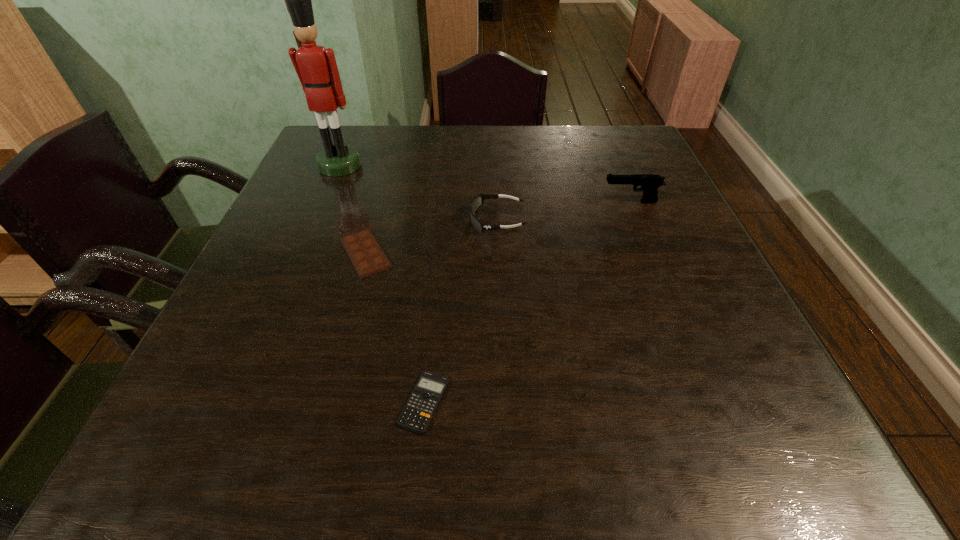
The image size is (960, 540). What are the coordinates of `object present at the near edge` in the screenshot? It's located at (418, 411).

Where is `object that is at the left edge`? object that is at the left edge is located at coordinates (316, 67).

At what (x,y) coordinates should I click in order to perform the action: click on object that is at the right edge. Please return your answer as a coordinate pair (x, y). The height and width of the screenshot is (540, 960). Looking at the image, I should click on (649, 183).

The width and height of the screenshot is (960, 540). I want to click on object present at the far left corner, so click(x=316, y=67).

Locate an element on the screen. The width and height of the screenshot is (960, 540). free region at the far edge is located at coordinates (416, 136).

I want to click on vacant area at the near edge of the desktop, so click(x=610, y=464).

Image resolution: width=960 pixels, height=540 pixels. I want to click on vacant area at the left edge of the desktop, so click(309, 265).

Find the location of a particular element. The image size is (960, 540). vacant space at the right edge is located at coordinates (660, 199).

Identify the location of blank space at the near left corner. (197, 449).

Where is `free space at the near right corner`? free space at the near right corner is located at coordinates (708, 473).